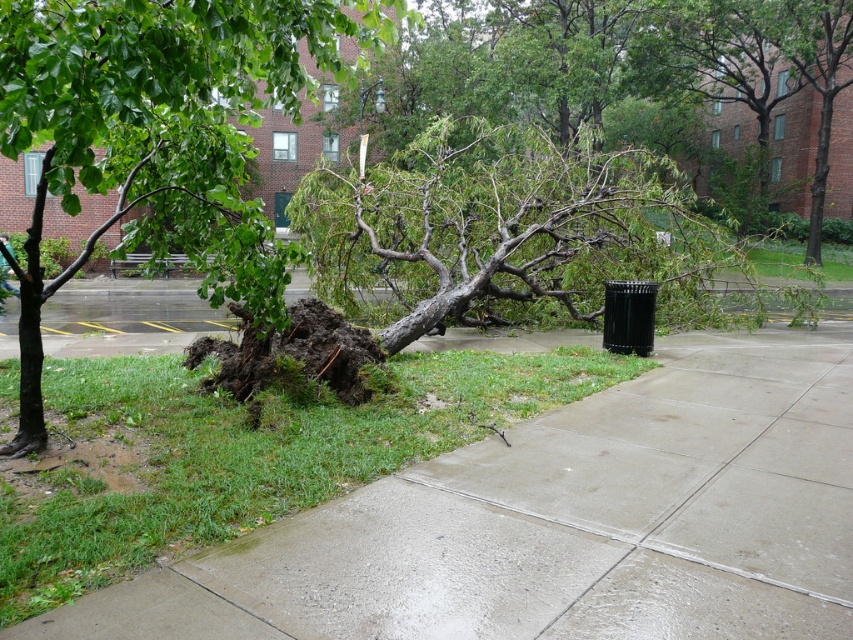
You are standing at the edge of the walkway and want to reach the concrete at center. Which direction should you walk to get there?

The concrete at center is located at point (561,522), so you should walk towards the center of the scene to reach it.

You are standing on the grassy area near the fallen tree and want to walk to the concrete at center. Which direction should you move relative to the green leafy tree at left?

The concrete at center is located to the right of the green leafy tree at left. To reach the concrete at center, you should move to the right side of the green leafy tree at left.

You are standing at the point marked as point (561, 522) in the image. What type of surface are you currently standing on?

The point (561, 522) is on concrete at center.